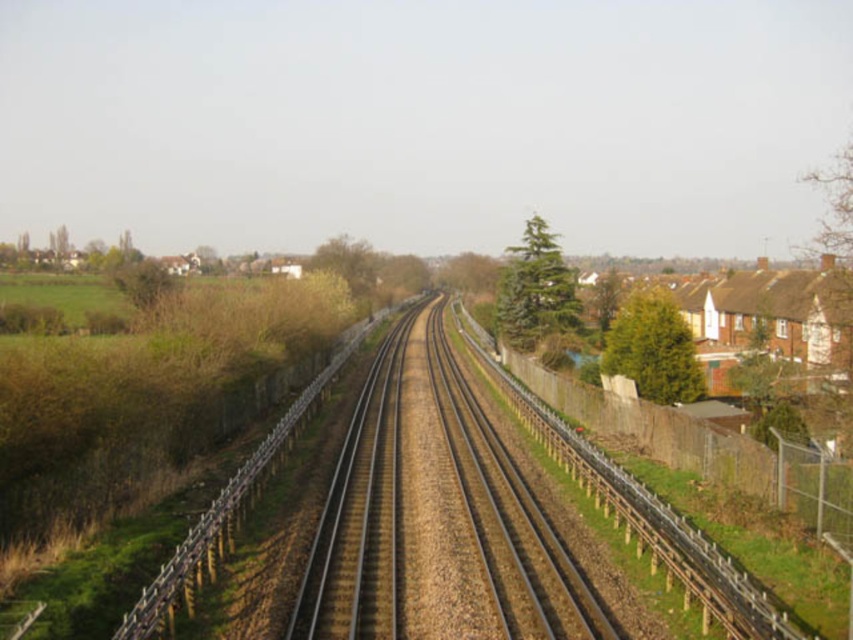
Question: In this image, where is green textured tree at right located relative to green textured tree at center-right?

Choices:
 (A) above
 (B) below

Answer: (B)

Question: Which object appears farthest from the camera in this image?

Choices:
 (A) green textured tree at right
 (B) green leafy tree at center
 (C) metallic train tracks at center

Answer: (B)

Question: Which object is positioned closest to the green textured tree at right?

Choices:
 (A) green textured tree at center-right
 (B) metallic train tracks at center

Answer: (A)

Question: Does green textured tree at right lie behind green leafy tree at center?

Choices:
 (A) yes
 (B) no

Answer: (B)

Question: Is green textured tree at right closer to the viewer compared to green textured tree at center-right?

Choices:
 (A) no
 (B) yes

Answer: (B)

Question: Which object is the farthest from the metallic train tracks at center?

Choices:
 (A) green textured tree at right
 (B) green textured tree at center-right
 (C) green leafy tree at center

Answer: (C)